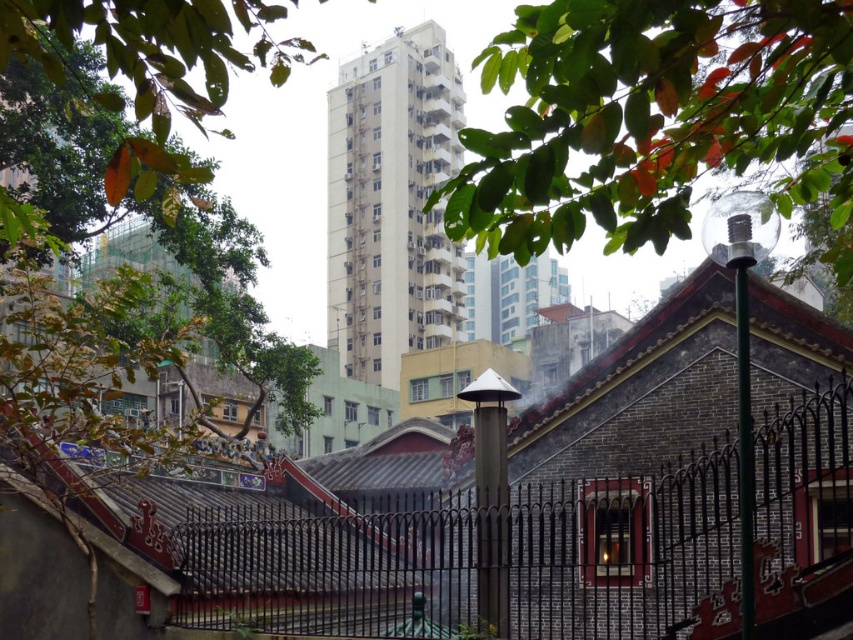
You are a drone operator tasked with capturing aerial footage of the scene. Your drone has a maximum flight range of 20 meters. You need to fly from the black wrought iron fence at lower left to the green leafy tree at left to get the best shot. Can your drone complete this flight without exceeding its range?

The black wrought iron fence at lower left is 19.41 meters away from the green leafy tree at left. Since the drone has a maximum flight range of 20 meters, it can complete the flight without exceeding its range because 19.41 meters is within the 20 meters limit.

You are standing in the urban area depicted in the image and want to determine the relative positions of two points. Which point is closer to you, point (223,576) or point (821,192)?

Point (223,576) is closer to you than point (821,192) because it is further to the viewer.